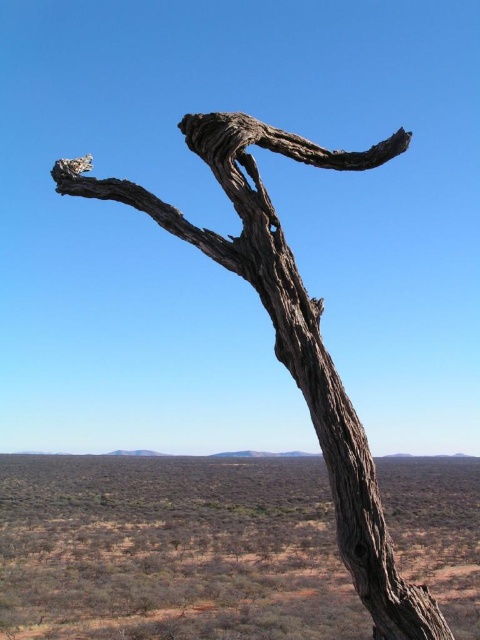
Question: Can you confirm if brown dry grass at lower left is positioned to the left of gray rough bark tree at center?

Choices:
 (A) yes
 (B) no

Answer: (A)

Question: Which point appears closest to the camera in this image?

Choices:
 (A) click(236, 480)
 (B) click(260, 145)

Answer: (B)

Question: Does brown dry grass at lower left have a smaller size compared to gray rough bark tree at center?

Choices:
 (A) no
 (B) yes

Answer: (A)

Question: Observing the image, what is the correct spatial positioning of brown dry grass at lower left in reference to gray rough bark tree at center?

Choices:
 (A) right
 (B) left

Answer: (B)

Question: Which object is closer to the camera taking this photo?

Choices:
 (A) brown dry grass at lower left
 (B) gray rough bark tree at center

Answer: (B)